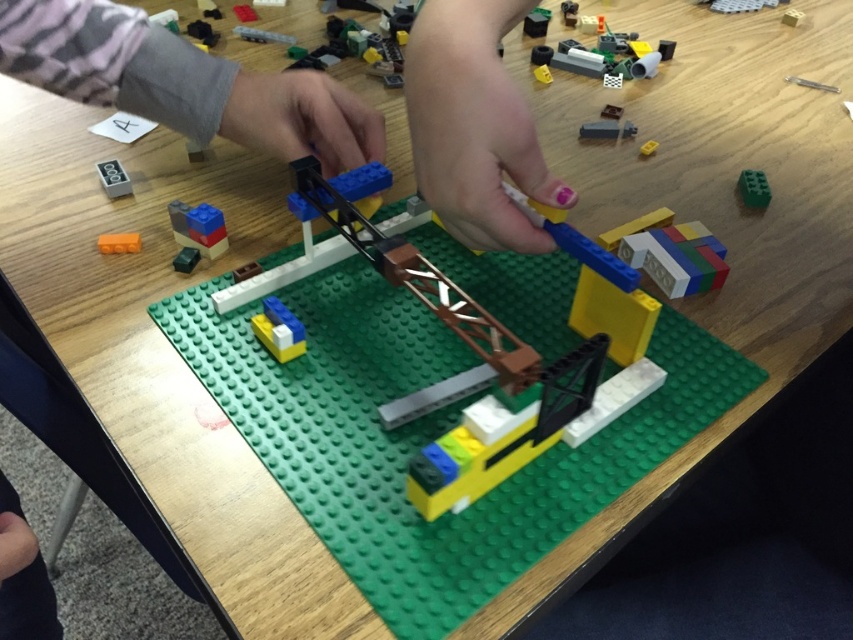
You are trying to place a new LEGO piece that is 2 cm wide. You have two options on the table, the green matte brick at upper right and the metallic gold cube at center. Which one can fit into a space that is exactly 3 cm wide?

The green matte brick at upper right can fit into a space that is exactly 3 cm wide because its width is less than the metallic gold cube at center, which may be too wide.

In the scene shown: You are a LEGO builder who needs to place a new piece between the green matte brick at upper right and the metallic gold cube at center. Which of the two pieces should you choose if you want to use the larger one first?

The green matte brick at upper right is larger than the metallic gold cube at center, so you should choose the green matte brick at upper right first.

You are trying to place a new LEGO piece between the matte plastic cube at lower left and the green matte brick at upper right. Which object should you move to create space if the new piece is wider than both?

Since the matte plastic cube at lower left is wider than the green matte brick at upper right, you should move the matte plastic cube at lower left to create enough space for the new piece.